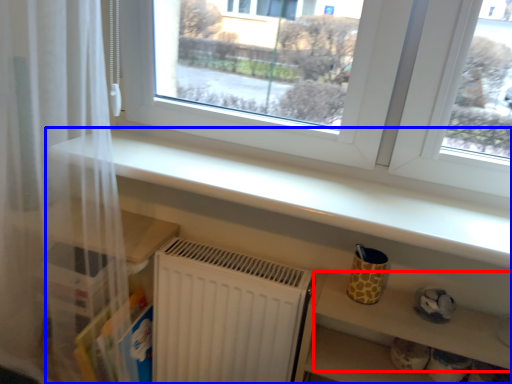
Question: Which object appears closest to the camera in this image, shelf (highlighted by a red box) or shelf (highlighted by a blue box)?

Choices:
 (A) shelf
 (B) shelf

Answer: (B)